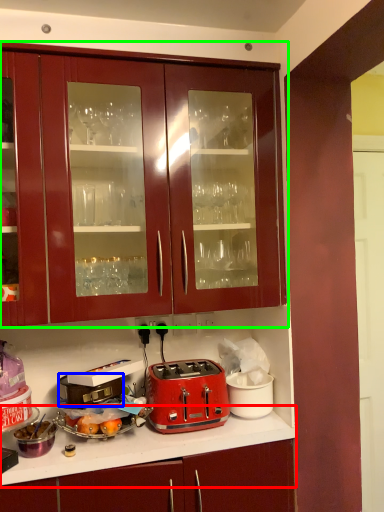
Question: Based on their relative distances, which object is farther from countertop (highlighted by a red box)? Choose from appliance (highlighted by a blue box) and cabinetry (highlighted by a green box).

Choices:
 (A) appliance
 (B) cabinetry

Answer: (B)